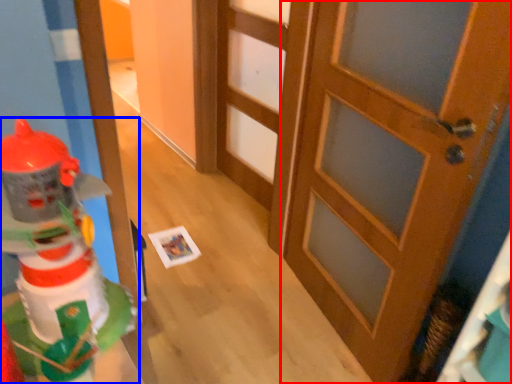
Question: Among these objects, which one is nearest to the camera, door (highlighted by a red box) or toy (highlighted by a blue box)?

Choices:
 (A) door
 (B) toy

Answer: (B)